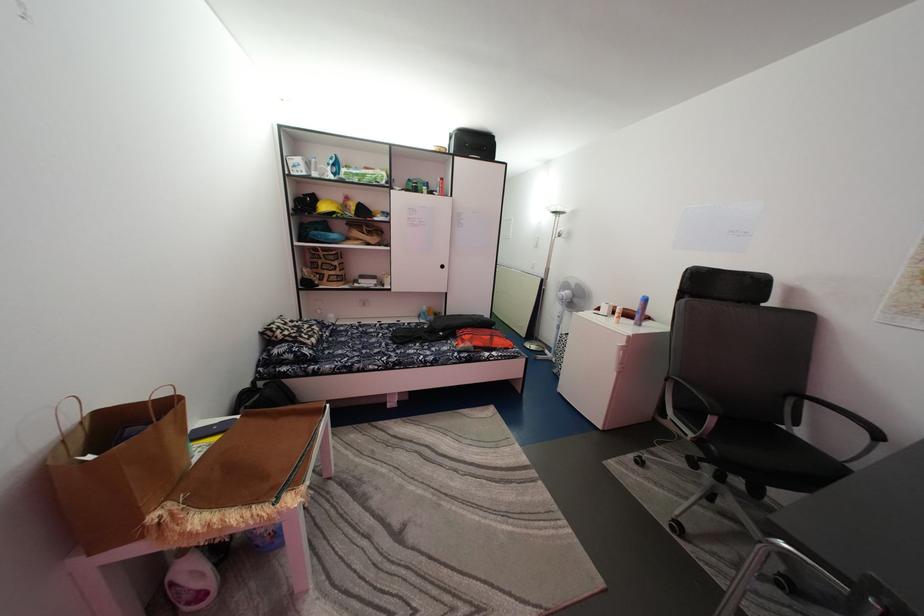
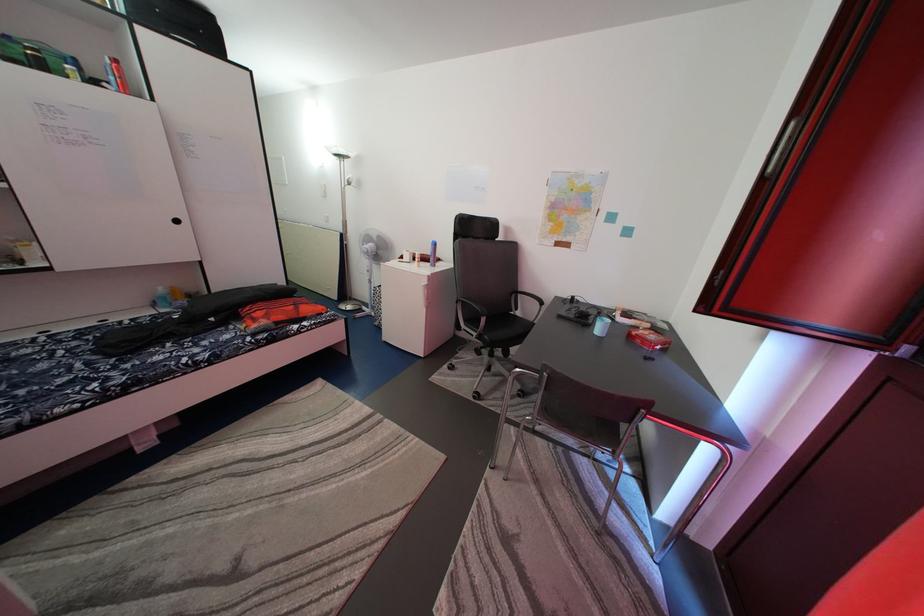
Question: How did the camera likely rotate?

Choices:
 (A) Left
 (B) Right
 (C) Up
 (D) Down

Answer: (B)